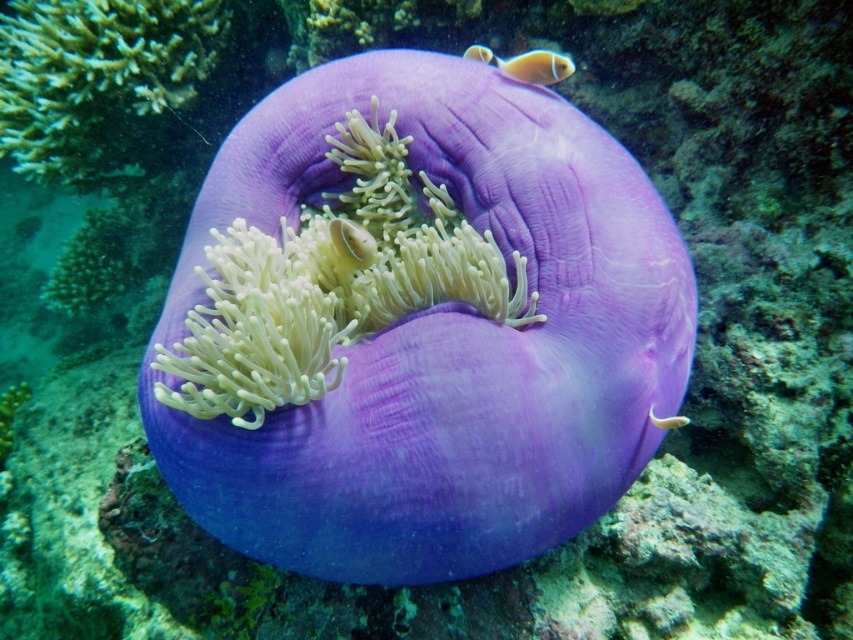
Identify the location of green coral at upper left. This screenshot has width=853, height=640. (97, 77).

Who is positioned more to the left, green coral at upper left or translucent white fish at center?

green coral at upper left is more to the left.

Does point (120, 24) come behind point (666, 428)?

That is True.

Locate an element on the screen. Image resolution: width=853 pixels, height=640 pixels. green coral at upper left is located at coordinates (97, 77).

Looking at this image, does purple soft coral at center have a larger size compared to orange matte fish at upper right?

Correct, purple soft coral at center is larger in size than orange matte fish at upper right.

Image resolution: width=853 pixels, height=640 pixels. What do you see at coordinates (445, 340) in the screenshot?
I see `purple soft coral at center` at bounding box center [445, 340].

Is point (381, 81) positioned after point (567, 58)?

No, (381, 81) is closer to viewer.

Locate an element on the screen. purple soft coral at center is located at coordinates (445, 340).

Is point (587, 236) in front of point (181, 29)?

Yes, it is.

Does point (537, 93) come farther from viewer compared to point (207, 49)?

No, it is in front of (207, 49).

Locate an element on the screen. The height and width of the screenshot is (640, 853). purple soft coral at center is located at coordinates (445, 340).

In order to click on purple soft coral at center in this screenshot , I will do `click(445, 340)`.